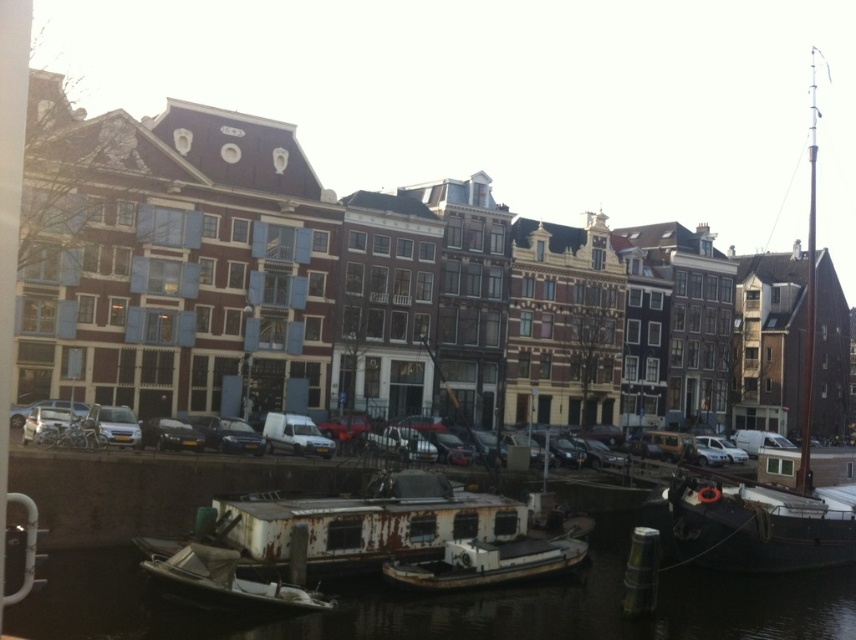
Question: Does rusty metal boat at lower right have a larger size compared to rusty metal boat at center?

Choices:
 (A) yes
 (B) no

Answer: (A)

Question: Does rusty metal water at lower center have a larger size compared to rusty metal boat at right?

Choices:
 (A) yes
 (B) no

Answer: (B)

Question: Which of the following is the closest to the observer?

Choices:
 (A) (800, 496)
 (B) (474, 541)
 (C) (129, 410)

Answer: (B)

Question: Which object appears farthest from the camera in this image?

Choices:
 (A) matte black car at center
 (B) rusty metal boat at lower right

Answer: (A)

Question: Where is rusty metal boat at right located in relation to rusty metal boat at lower right in the image?

Choices:
 (A) above
 (B) below

Answer: (A)

Question: Which object is positioned farthest from the rusty metal boat at lower left?

Choices:
 (A) rusty metal boat at right
 (B) rusty metal water at lower center
 (C) matte black car at center

Answer: (A)